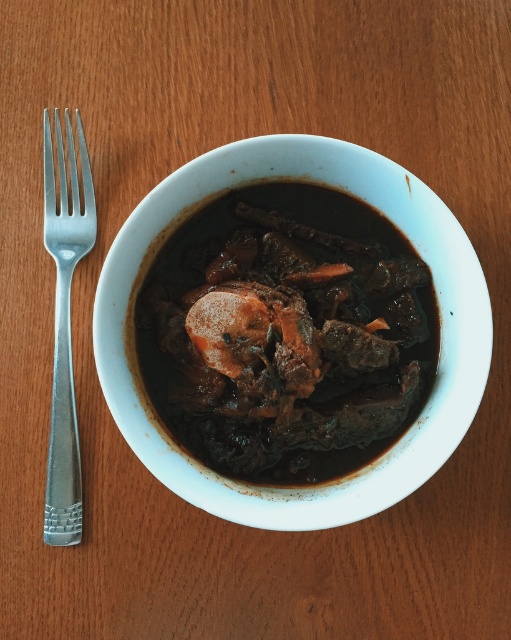
Question: In this image, where is brown matte stew at center located relative to silver metallic fork at left?

Choices:
 (A) above
 (B) below

Answer: (B)

Question: In this image, where is brown matte stew at center located relative to silver metallic fork at left?

Choices:
 (A) above
 (B) below

Answer: (B)

Question: Is brown matte stew at center above silver metallic fork at left?

Choices:
 (A) no
 (B) yes

Answer: (A)

Question: Which point appears farthest from the camera in this image?

Choices:
 (A) (56, 397)
 (B) (219, 260)

Answer: (A)